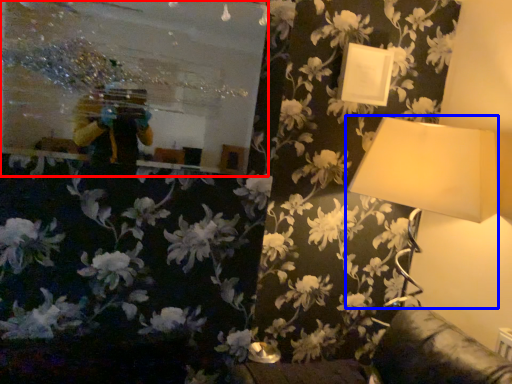
Question: Which object appears farthest to the camera in this image, mirror (highlighted by a red box) or lamp (highlighted by a blue box)?

Choices:
 (A) mirror
 (B) lamp

Answer: (B)